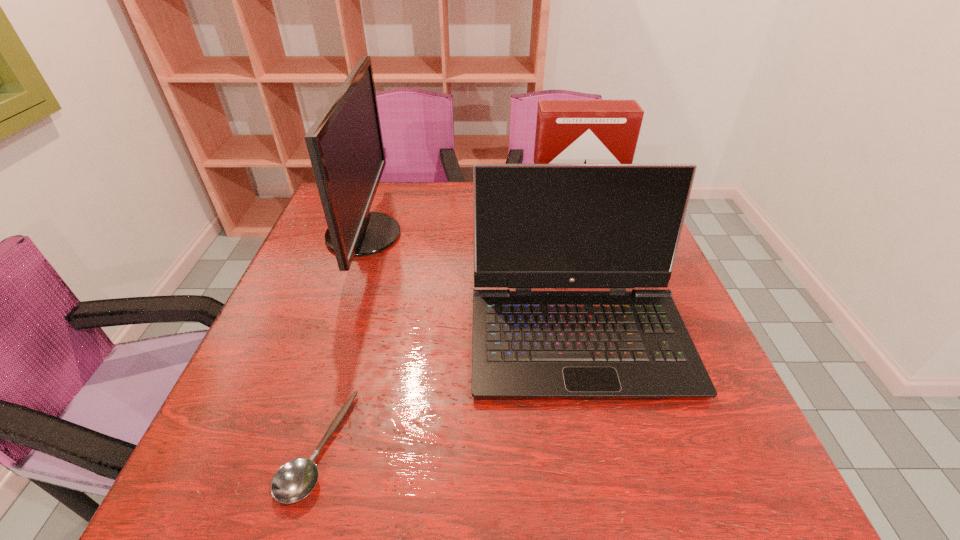
Find the location of a particular element. The height and width of the screenshot is (540, 960). free space between the laptop computer and the ladle is located at coordinates (x=447, y=389).

Where is `object that ranks as the third closest to the shortest object`? object that ranks as the third closest to the shortest object is located at coordinates (567, 131).

At what (x,y) coordinates should I click in order to perform the action: click on object that stands as the third closest to the cigarette_case. Please return your answer as a coordinate pair (x, y). The width and height of the screenshot is (960, 540). Looking at the image, I should click on (294, 480).

Where is `free spot that satisfies the following two spatial constraints: 1. on the screen side of the monitor; 2. on the left side of the shortest object`? Image resolution: width=960 pixels, height=540 pixels. free spot that satisfies the following two spatial constraints: 1. on the screen side of the monitor; 2. on the left side of the shortest object is located at coordinates (292, 446).

Image resolution: width=960 pixels, height=540 pixels. I want to click on vacant space that satisfies the following two spatial constraints: 1. on the front-facing side of the cigarette_case; 2. on the screen side of the monitor, so click(x=571, y=235).

The image size is (960, 540). What are the coordinates of `blank area in the image that satisfies the following two spatial constraints: 1. on the front-facing side of the cigarette_case; 2. on the screen side of the monitor` in the screenshot? It's located at (571, 235).

Where is `blank area in the image that satisfies the following two spatial constraints: 1. on the front-facing side of the cigarette_case; 2. on the screen side of the monitor`? The image size is (960, 540). blank area in the image that satisfies the following two spatial constraints: 1. on the front-facing side of the cigarette_case; 2. on the screen side of the monitor is located at coordinates (571, 235).

Where is `vacant position in the image that satisfies the following two spatial constraints: 1. on the front-facing side of the cigarette_case; 2. on the screen side of the monitor`? vacant position in the image that satisfies the following two spatial constraints: 1. on the front-facing side of the cigarette_case; 2. on the screen side of the monitor is located at coordinates (571, 235).

This screenshot has height=540, width=960. Identify the location of vacant position in the image that satisfies the following two spatial constraints: 1. on the front-facing side of the cigarette_case; 2. on the screen side of the monitor. (571, 235).

Where is `vacant space that satisfies the following two spatial constraints: 1. on the front-facing side of the cigarette_case; 2. on the screen side of the monitor`? vacant space that satisfies the following two spatial constraints: 1. on the front-facing side of the cigarette_case; 2. on the screen side of the monitor is located at coordinates (571, 235).